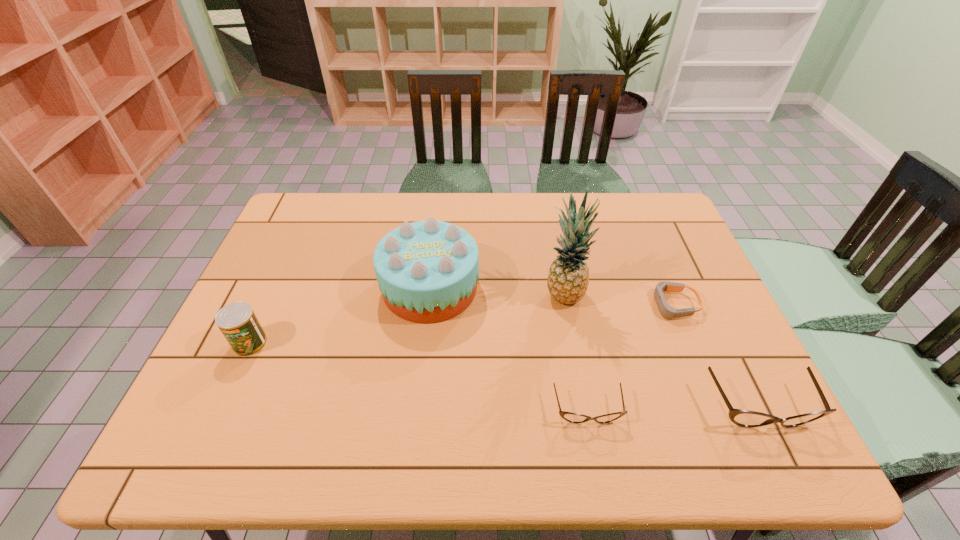
The height and width of the screenshot is (540, 960). I want to click on vacant area at the far edge, so click(454, 216).

Identify the location of vacant space at the near edge of the desktop. This screenshot has height=540, width=960. (627, 386).

Find the location of a particular element. This screenshot has width=960, height=540. free region at the left edge is located at coordinates (258, 314).

You are a GUI agent. You are given a task and a screenshot of the screen. Output one action in this format:
    pyautogui.click(x=<x>, y=<y>)
    Task: Click on the vacant space at the right edge of the desktop
    The image size is (960, 540).
    Given the screenshot: What is the action you would take?
    pyautogui.click(x=707, y=309)

In the image, there is a desktop. Where is `vacant space at the far left corner`? vacant space at the far left corner is located at coordinates (313, 201).

Find the location of a particular element. free location at the far right corner of the desktop is located at coordinates (665, 225).

Identify the location of free area in between the third shortest object and the pineapple. The height and width of the screenshot is (540, 960). (661, 350).

Where is `free space that is in between the fifth shortest object and the pineapple`? The height and width of the screenshot is (540, 960). free space that is in between the fifth shortest object and the pineapple is located at coordinates (497, 291).

You are a GUI agent. You are given a task and a screenshot of the screen. Output one action in this format:
    pyautogui.click(x=<x>, y=<y>)
    Task: Click on the blank region between the can and the fourth tallest object
    
    Given the screenshot: What is the action you would take?
    pyautogui.click(x=504, y=375)

Where is `vacant area that lies between the fourth shortest object and the goggles`? The width and height of the screenshot is (960, 540). vacant area that lies between the fourth shortest object and the goggles is located at coordinates (462, 324).